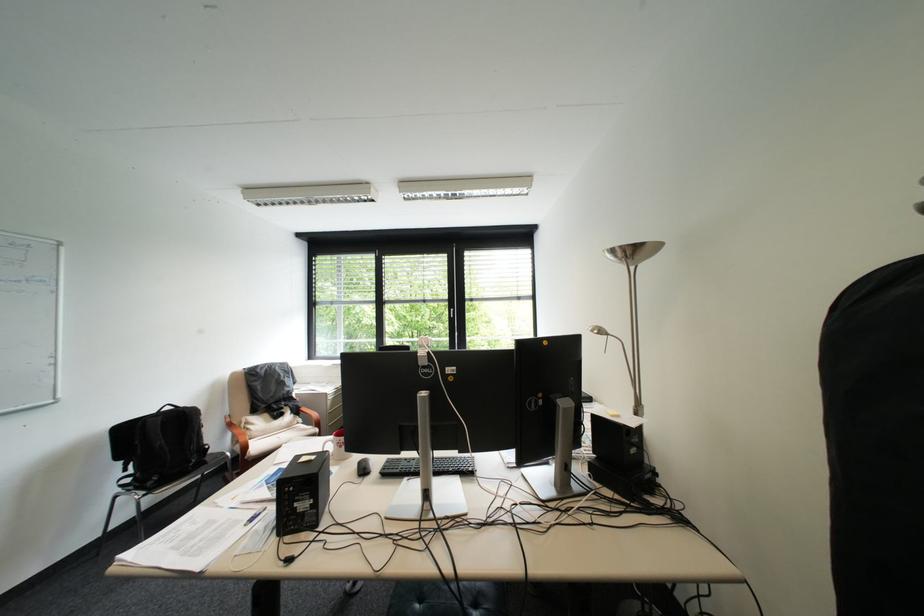
The width and height of the screenshot is (924, 616). What do you see at coordinates (269, 427) in the screenshot?
I see `the chair sitting surface` at bounding box center [269, 427].